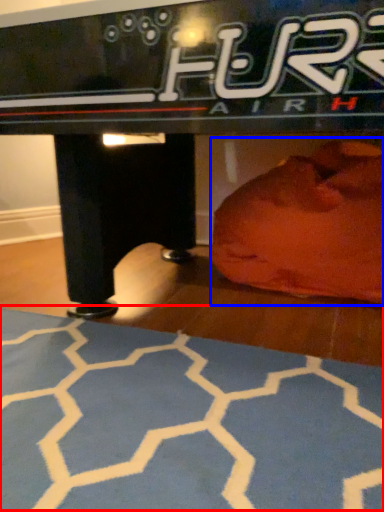
Question: Which point is further to the camera, yoga mat (highlighted by a red box) or bean bag chair (highlighted by a blue box)?

Choices:
 (A) yoga mat
 (B) bean bag chair

Answer: (B)